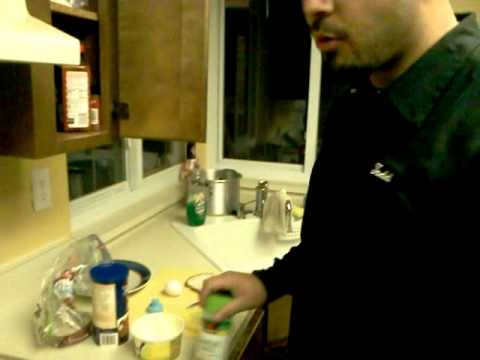
You are a GUI agent. You are given a task and a screenshot of the screen. Output one action in this format:
    pyautogui.click(x=<x>, y=<y>)
    Task: Click on the windows
    Image resolution: width=480 pixels, height=360 pixels.
    Given the screenshot: What is the action you would take?
    pyautogui.click(x=125, y=188), pyautogui.click(x=267, y=162)